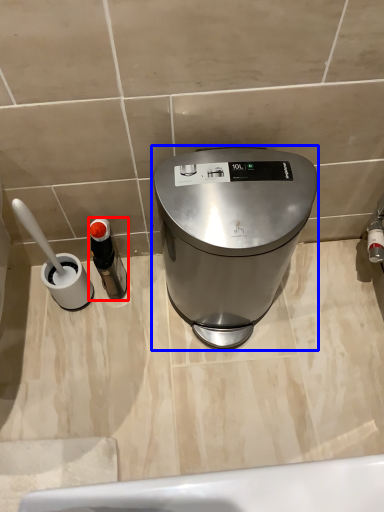
Question: Which of the following is the closest to the observer, bottle (highlighted by a red box) or waste container (highlighted by a blue box)?

Choices:
 (A) bottle
 (B) waste container

Answer: (B)